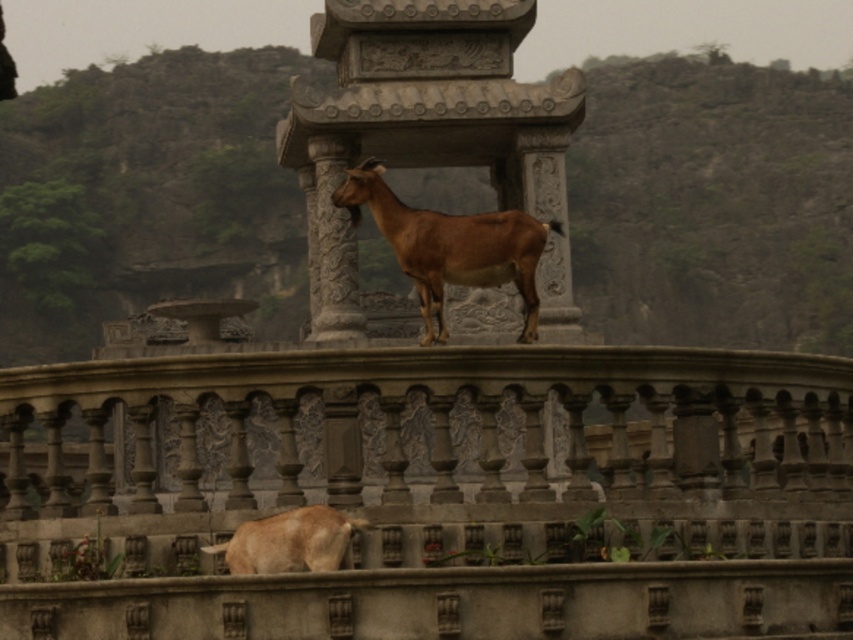
You are standing at the center of the image and want to locate the brown stone hillside at upper center. What are the coordinates where you should look?

The coordinates to locate the brown stone hillside at upper center are at point (148, 196).

You are a photographer wanting to capture the brown matte goat at lower center and the gray stone balustrade at lower center in a single frame. Based on their positions, which object is positioned to the right side of the other?

The gray stone balustrade at lower center is to the right of the brown matte goat at lower center.